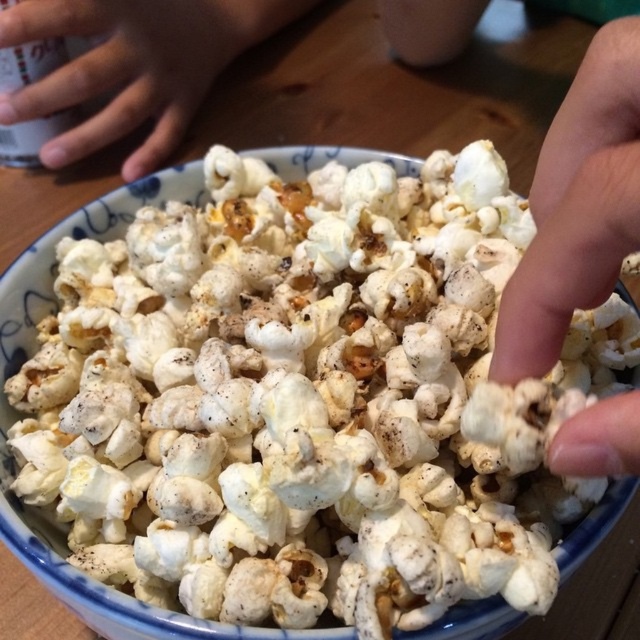
You are looking at the bowl of popcorn and notice two points marked in the image. The first point is at coordinate point (611, 225) and the second is at point (84, 16). Which point is closer to you?

Point (611, 225) is closer to you than point (84, 16).